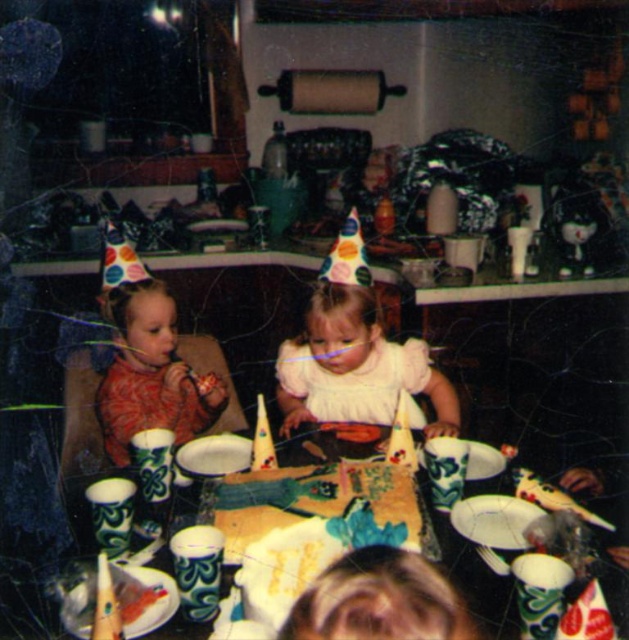
Does matte red dress at left come behind green textured cups at center?

Yes, it is.

Consider the image. Is matte red dress at left to the right of green textured cups at center from the viewer's perspective?

No, matte red dress at left is not to the right of green textured cups at center.

Is point (135, 420) behind point (618, 621)?

Yes, it is behind point (618, 621).

What are the coordinates of `matte red dress at left` in the screenshot? It's located at (x=150, y=372).

Is white satin dress at center to the left of matte red dress at left from the viewer's perspective?

No, white satin dress at center is not to the left of matte red dress at left.

Is white satin dress at center further to the viewer compared to matte red dress at left?

No, it is in front of matte red dress at left.

Image resolution: width=629 pixels, height=640 pixels. Describe the element at coordinates (355, 355) in the screenshot. I see `white satin dress at center` at that location.

At what (x,y) coordinates should I click in order to perform the action: click on white satin dress at center. Please return your answer as a coordinate pair (x, y). The image size is (629, 640). Looking at the image, I should click on (355, 355).

Find the location of `white satin dress at center`. white satin dress at center is located at coordinates (355, 355).

How much distance is there between white satin dress at center and green textured cups at center?

white satin dress at center is 20.06 inches away from green textured cups at center.

Identify the location of white satin dress at center. The image size is (629, 640). (355, 355).

This screenshot has width=629, height=640. In order to click on white satin dress at center in this screenshot , I will do tap(355, 355).